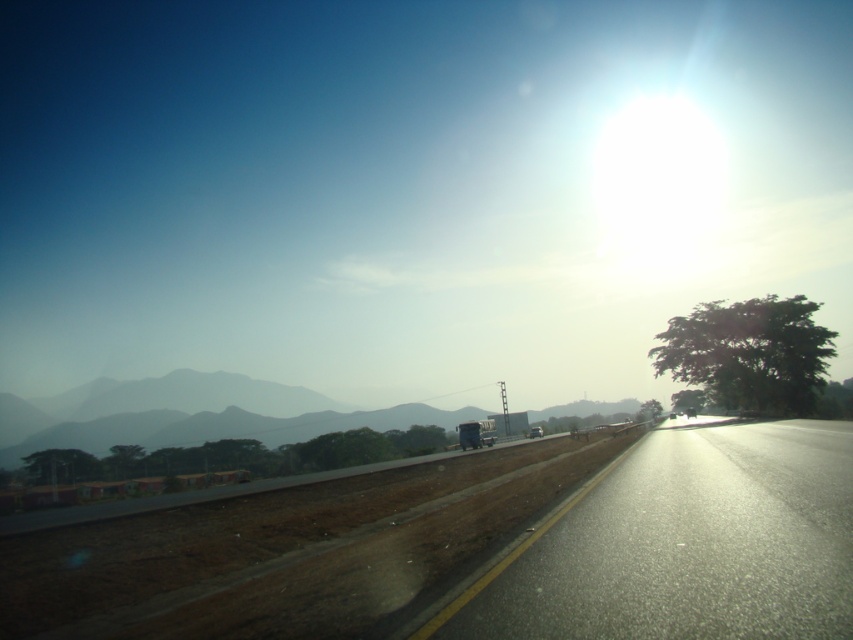
You are driving a metallic blue trailer truck at center and want to overtake a metallic silver car at center on this road. Given the road layout described in the scene, which direction should you move your vehicle to safely overtake the car?

The metallic blue trailer truck at center is to the left of the metallic silver car at center. To safely overtake the car, the truck should move to the right side of the road since the car is positioned to the right of the truck, allowing the truck to pass on the right side.

You are driving a metallic silver car at center on a black asphalt highway at center. You notice that the highway is sloping. Is the highway sloping upwards or downwards in front of your car?

The black asphalt highway at center is above the metallic silver car at center, so the highway is sloping upwards in front of the car.

You are standing on the side of the road and want to cross the black asphalt highway at center. If your walking speed is 1.5 meters per second, how many seconds will it take you to reach the highway?

The black asphalt highway at center and camera are 5.00 meters apart. At a walking speed of 1.5 meters per second, it will take approximately 3.33 seconds to reach the highway.